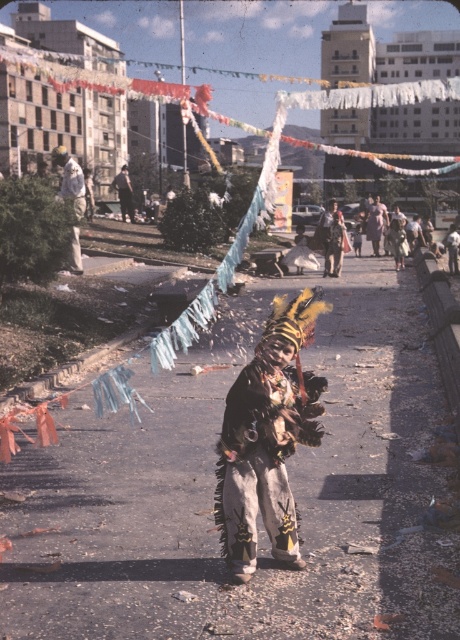
Is white cotton pants at center smaller than leather jacket at center?

Incorrect, white cotton pants at center is not smaller in size than leather jacket at center.

The height and width of the screenshot is (640, 460). Describe the element at coordinates (72, 198) in the screenshot. I see `white cotton pants at center` at that location.

You are a GUI agent. You are given a task and a screenshot of the screen. Output one action in this format:
    pyautogui.click(x=<x>, y=<y>)
    Task: Click on the white cotton pants at center
    Image resolution: width=460 pixels, height=640 pixels.
    Given the screenshot: What is the action you would take?
    pyautogui.click(x=72, y=198)

Does multicolored feathered headdress at center appear on the right side of white cotton pants at center?

Correct, you'll find multicolored feathered headdress at center to the right of white cotton pants at center.

What do you see at coordinates (268, 436) in the screenshot?
I see `multicolored feathered headdress at center` at bounding box center [268, 436].

The height and width of the screenshot is (640, 460). What do you see at coordinates (268, 436) in the screenshot? I see `multicolored feathered headdress at center` at bounding box center [268, 436].

I want to click on multicolored feathered headdress at center, so click(268, 436).

Can you confirm if white cotton pants at center is shorter than dark brown leather jacket at center?

In fact, white cotton pants at center may be taller than dark brown leather jacket at center.

Who is more forward, (65, 189) or (132, 205)?

Positioned in front is point (65, 189).

Identify the location of white cotton pants at center. (72, 198).